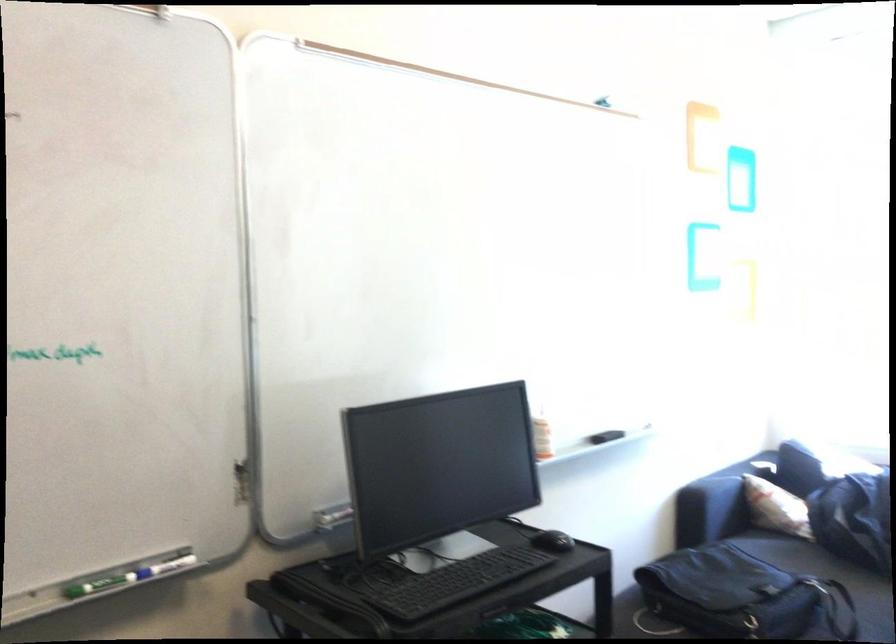
Describe the element at coordinates (552, 541) in the screenshot. I see `a black computer mouse` at that location.